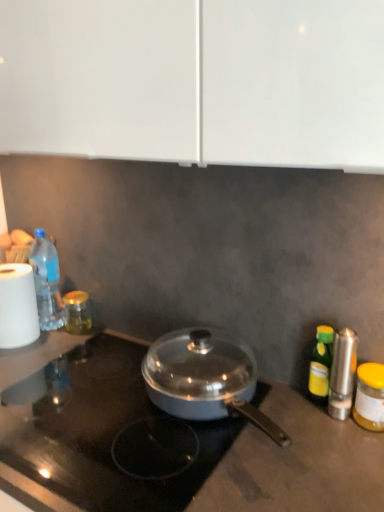
You are a GUI agent. You are given a task and a screenshot of the screen. Output one action in this format:
    pyautogui.click(x=<x>, y=<y>)
    Task: Click on the unoccupied area in front of gold glass jar at left, the 4th bottle from the front
    
    Given the screenshot: What is the action you would take?
    pyautogui.click(x=63, y=351)